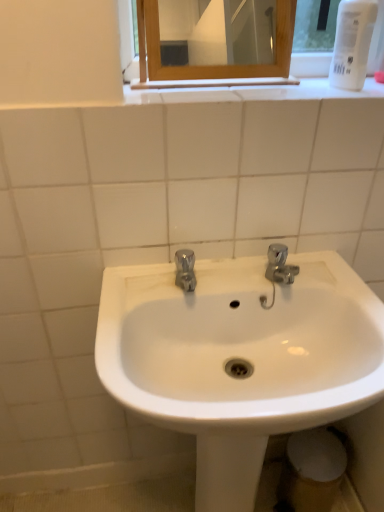
The width and height of the screenshot is (384, 512). Identify the location of vacant space that is to the left of polished chrome faucet at center. (140, 289).